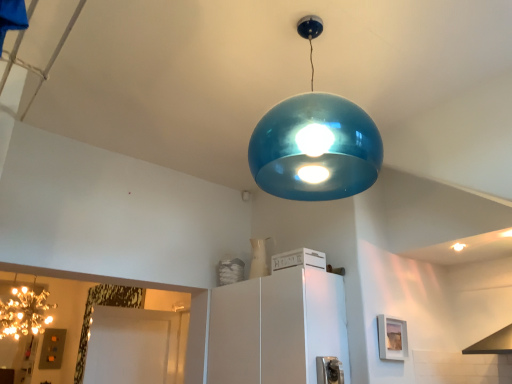
Question: Can you confirm if glossy metallic light bulb at upper center is taller than white matte crate at center, acting as the 2th appliance starting from the front?

Choices:
 (A) yes
 (B) no

Answer: (B)

Question: Is glossy metallic light bulb at upper center next to white matte crate at center, positioned as the 2th appliance in bottom-to-top order, and touching it?

Choices:
 (A) yes
 (B) no

Answer: (B)

Question: Is glossy metallic light bulb at upper center turned away from white matte crate at center, acting as the 2th appliance starting from the front?

Choices:
 (A) yes
 (B) no

Answer: (B)

Question: Could you tell me if glossy metallic light bulb at upper center is turned towards white matte crate at center, acting as the 2th appliance starting from the front?

Choices:
 (A) yes
 (B) no

Answer: (B)

Question: Would you say glossy metallic light bulb at upper center is outside white matte crate at center, acting as the 2th appliance starting from the front?

Choices:
 (A) no
 (B) yes

Answer: (B)

Question: In terms of height, does sparkling gold chandelier at left look taller or shorter compared to metallic silver outlet at lower center, the 2th appliance in the top-to-bottom sequence?

Choices:
 (A) tall
 (B) short

Answer: (A)

Question: Is sparkling gold chandelier at left inside or outside of metallic silver outlet at lower center, which is the 1th appliance in bottom-to-top order?

Choices:
 (A) outside
 (B) inside

Answer: (A)

Question: Is sparkling gold chandelier at left in front of or behind metallic silver outlet at lower center, which ranks as the 2th appliance in back-to-front order, in the image?

Choices:
 (A) front
 (B) behind

Answer: (B)

Question: From a real-world perspective, is sparkling gold chandelier at left positioned above or below metallic silver outlet at lower center, which is the 1th appliance in bottom-to-top order?

Choices:
 (A) below
 (B) above

Answer: (B)

Question: In the image, is white matte cabinet at center on the left side or the right side of sparkling gold chandelier at left?

Choices:
 (A) right
 (B) left

Answer: (A)

Question: Considering the positions of point (240, 367) and point (39, 314), is point (240, 367) closer or farther from the camera than point (39, 314)?

Choices:
 (A) farther
 (B) closer

Answer: (B)

Question: Is white matte cabinet at center taller or shorter than sparkling gold chandelier at left?

Choices:
 (A) tall
 (B) short

Answer: (A)

Question: From a real-world perspective, is white matte cabinet at center above or below sparkling gold chandelier at left?

Choices:
 (A) below
 (B) above

Answer: (A)

Question: Considering the positions of white matte crate at center, positioned as the 2th appliance in bottom-to-top order, and white matte cabinet at center in the image, is white matte crate at center, positioned as the 2th appliance in bottom-to-top order, taller or shorter than white matte cabinet at center?

Choices:
 (A) short
 (B) tall

Answer: (A)

Question: Based on their positions, is white matte crate at center, acting as the 2th appliance starting from the front, located to the left or right of white matte cabinet at center?

Choices:
 (A) right
 (B) left

Answer: (A)